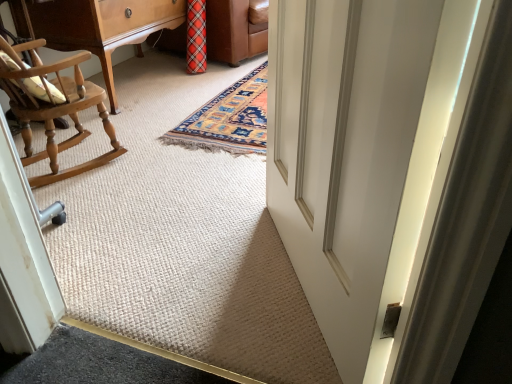
Describe the element at coordinates (97, 26) in the screenshot. I see `wooden rocking chair at left` at that location.

Measure the distance between point (69,30) and camera.

2.12 meters.

Identify the location of wooden rocking chair at left. This screenshot has width=512, height=384. (97, 26).

Identify the location of white smooth door at center. (391, 172).

What do you see at coordinates (391, 172) in the screenshot?
I see `white smooth door at center` at bounding box center [391, 172].

At what (x,y) coordinates should I click in order to perform the action: click on wooden rocking chair at left. Please return your answer as a coordinate pair (x, y). The image size is (512, 384). Looking at the image, I should click on (97, 26).

Which is more to the left, wooden rocking chair at left or white smooth door at center?

wooden rocking chair at left is more to the left.

Is wooden rocking chair at left further to the viewer compared to white smooth door at center?

Yes, it is behind white smooth door at center.

Does point (72, 20) lie behind point (411, 32)?

Yes, it is.

From the image's perspective, is wooden rocking chair at left above white smooth door at center?

Yes, from the image's perspective, wooden rocking chair at left is over white smooth door at center.

From a real-world perspective, is wooden rocking chair at left physically located above or below white smooth door at center?

In terms of real-world spatial position, wooden rocking chair at left is below white smooth door at center.

Is wooden rocking chair at left wider than white smooth door at center?

Yes.

Considering the sizes of wooden rocking chair at left and white smooth door at center in the image, is wooden rocking chair at left taller or shorter than white smooth door at center?

Clearly, wooden rocking chair at left is shorter compared to white smooth door at center.

Can you confirm if wooden rocking chair at left is smaller than white smooth door at center?

No.

In the scene shown: Is white smooth door at center a part of wooden rocking chair at left?

No, wooden rocking chair at left does not contain white smooth door at center.

Is wooden rocking chair at left directly adjacent to white smooth door at center?

They are not placed beside each other.

Is wooden rocking chair at left facing away from white smooth door at center?

No, white smooth door at center is not at the back of wooden rocking chair at left.

How many degrees apart are the facing directions of wooden rocking chair at left and white smooth door at center?

The angle between the facing direction of wooden rocking chair at left and the facing direction of white smooth door at center is 151 degrees.

At what (x,y) coordinates should I click in order to perform the action: click on furniture on the left side of white smooth door at center. Please return your answer as a coordinate pair (x, y). Image resolution: width=512 pixels, height=384 pixels. Looking at the image, I should click on (97, 26).

Is white smooth door at center at the left side of wooden rocking chair at left?

No.

Is white smooth door at center closer to the viewer compared to wooden rocking chair at left?

Yes, white smooth door at center is closer to the viewer.

Which is closer to the camera, [408,135] or [54,46]?

Point [408,135].

From the image's perspective, which is below, white smooth door at center or wooden rocking chair at left?

From the image's view, white smooth door at center is below.

From a real-world perspective, between white smooth door at center and wooden rocking chair at left, who is vertically lower?

wooden rocking chair at left, from a real-world perspective.

Looking at this image, considering the sizes of objects white smooth door at center and wooden rocking chair at left in the image provided, who is wider, white smooth door at center or wooden rocking chair at left?

wooden rocking chair at left is wider.

Between white smooth door at center and wooden rocking chair at left, which one has less height?

With less height is wooden rocking chair at left.

Between white smooth door at center and wooden rocking chair at left, which one has smaller size?

Smaller between the two is white smooth door at center.

Can wooden rocking chair at left be found inside white smooth door at center?

Actually, wooden rocking chair at left is outside white smooth door at center.

Is white smooth door at center next to wooden rocking chair at left?

They are not placed beside each other.

Does white smooth door at center turn towards wooden rocking chair at left?

No, white smooth door at center is not oriented towards wooden rocking chair at left.

What's the angular difference between white smooth door at center and wooden rocking chair at left's facing directions?

white smooth door at center and wooden rocking chair at left are facing 151 degrees away from each other.

This screenshot has height=384, width=512. I want to click on door that is in front of the wooden rocking chair at left, so click(x=391, y=172).

The image size is (512, 384). In order to click on door located in front of the wooden rocking chair at left in this screenshot , I will do `click(391, 172)`.

Find the location of a particular element. The height and width of the screenshot is (384, 512). furniture located above the white smooth door at center (from the image's perspective) is located at coordinates (97, 26).